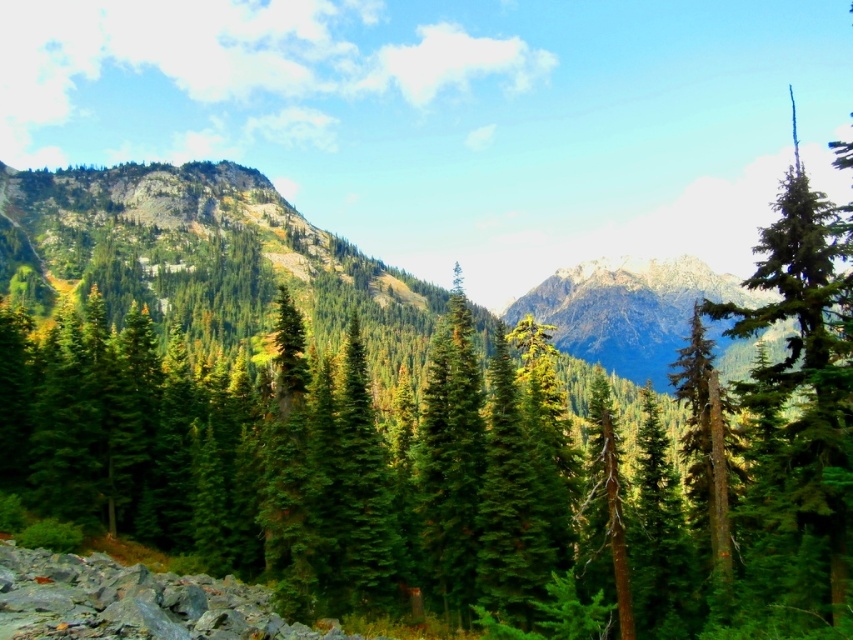
Which is more to the left, green matte tree at right or snowy rocky mountain at center?

snowy rocky mountain at center

Which is behind, point (781, 193) or point (628, 272)?

The point (628, 272) is behind.

Does point (808, 356) lie behind point (653, 346)?

That is False.

You are a GUI agent. You are given a task and a screenshot of the screen. Output one action in this format:
    pyautogui.click(x=<x>, y=<y>)
    Task: Click on the green matte tree at right
    This screenshot has width=853, height=640.
    Given the screenshot: What is the action you would take?
    pos(799,419)

The width and height of the screenshot is (853, 640). Find the location of `green forested mountain at center`. green forested mountain at center is located at coordinates (200, 256).

Who is positioned more to the right, green forested mountain at center or snowy rocky mountain at center?

snowy rocky mountain at center

Identify the location of green forested mountain at center. (200, 256).

Does point (189, 176) come closer to viewer compared to point (799, 221)?

No, it is behind (799, 221).

This screenshot has height=640, width=853. What do you see at coordinates (200, 256) in the screenshot?
I see `green forested mountain at center` at bounding box center [200, 256].

The width and height of the screenshot is (853, 640). I want to click on green forested mountain at center, so click(x=200, y=256).

At what (x,y) coordinates should I click in order to perform the action: click on green forested mountain at center. Please return your answer as a coordinate pair (x, y). The height and width of the screenshot is (640, 853). Looking at the image, I should click on click(200, 256).